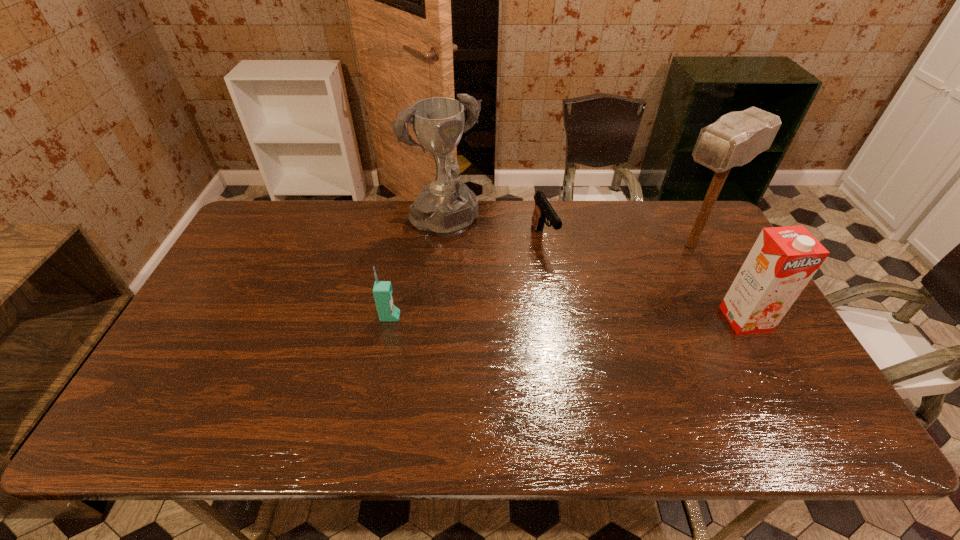
Identify which object is the closest to the award. Please provide its 2D coordinates. Your answer should be formatted as a tuple, i.e. [(x, y)], where the tuple contains the x and y coordinates of a point satisfying the conditions above.

[(543, 210)]

This screenshot has width=960, height=540. What are the coordinates of `vacant space that satisfies the following two spatial constraints: 1. on the front side of the third shortest object; 2. on the left side of the mallet` in the screenshot? It's located at (729, 319).

Locate an element on the screen. free space that satisfies the following two spatial constraints: 1. on the front side of the award; 2. on the right side of the pistol is located at coordinates (444, 239).

Locate an element on the screen. The width and height of the screenshot is (960, 540). free space that satisfies the following two spatial constraints: 1. on the front side of the mallet; 2. on the right side of the third tallest object is located at coordinates (729, 319).